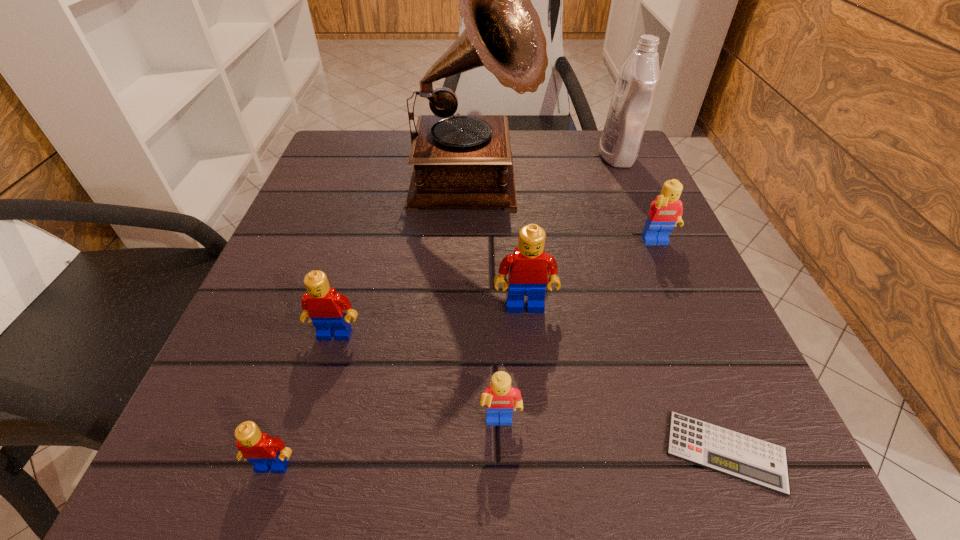
Where is `free space that satisfies the following two spatial constraints: 1. on the horn of the brown record player; 2. on the front-facing side of the second farthest red Lego`? free space that satisfies the following two spatial constraints: 1. on the horn of the brown record player; 2. on the front-facing side of the second farthest red Lego is located at coordinates (468, 334).

Locate an element on the screen. free space that satisfies the following two spatial constraints: 1. on the face of the calculator; 2. on the left side of the nearer yellow Lego is located at coordinates (501, 451).

Locate an element on the screen. vacant space that satisfies the following two spatial constraints: 1. on the front side of the detergent; 2. on the horn of the record player is located at coordinates (630, 187).